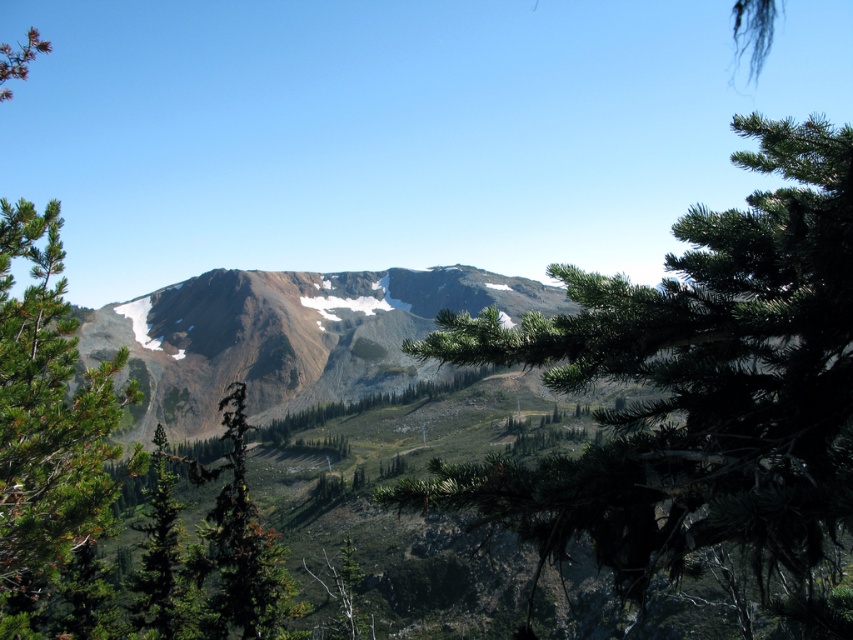
Question: Does green needle-like branches at center have a lesser width compared to green leafy tree at center?

Choices:
 (A) no
 (B) yes

Answer: (A)

Question: Considering the relative positions of green leafy tree at center and green matte tree at lower left in the image provided, where is green leafy tree at center located with respect to green matte tree at lower left?

Choices:
 (A) above
 (B) below

Answer: (B)

Question: Among these points, which one is nearest to the camera?

Choices:
 (A) (78, 458)
 (B) (688, 522)

Answer: (A)

Question: Which of the following is the closest to the observer?

Choices:
 (A) (297, 602)
 (B) (90, 515)
 (C) (177, 612)

Answer: (B)

Question: Which object appears closest to the camera in this image?

Choices:
 (A) green needle-like branches at center
 (B) green needle-like tree at left
 (C) green leafy tree at center
 (D) green matte tree at lower left

Answer: (A)

Question: Is green needle-like branches at center positioned behind green needle-like tree at left?

Choices:
 (A) yes
 (B) no

Answer: (B)